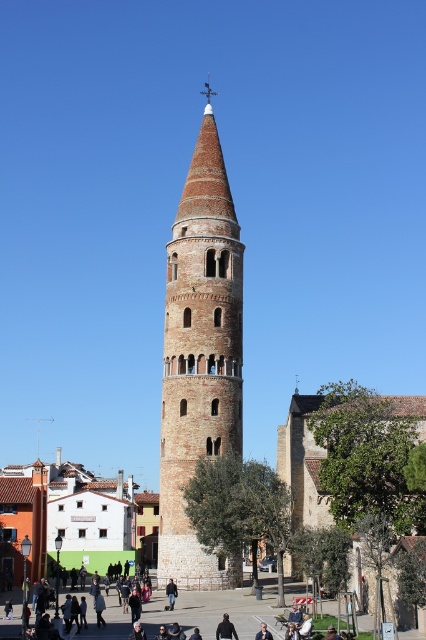
Question: Does dark brown leather jacket at center appear on the right side of black fabric person at center?

Choices:
 (A) yes
 (B) no

Answer: (B)

Question: Which point is closer to the camera?

Choices:
 (A) (166, 584)
 (B) (172, 330)
 (C) (259, 636)
 (D) (238, 632)

Answer: (C)

Question: Is dark brown leather jacket at center to the right of light brown leather jacket at center from the viewer's perspective?

Choices:
 (A) no
 (B) yes

Answer: (A)

Question: Which point is closer to the camera?

Choices:
 (A) (172, 592)
 (B) (155, 616)
 (C) (264, 628)
 (D) (221, 422)

Answer: (C)

Question: Can you confirm if dark brown leather jacket at center is thinner than light brown leather jacket at center?

Choices:
 (A) no
 (B) yes

Answer: (A)

Question: Which of the following is the farthest from the observer?

Choices:
 (A) black fabric person at center
 (B) light brown leather jacket at center

Answer: (A)